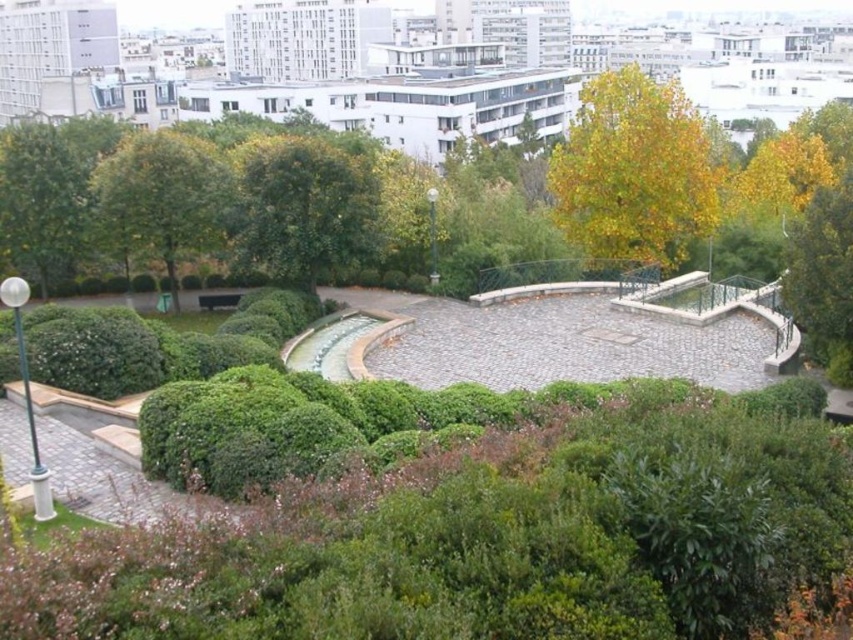
Question: Which object is closer to the camera taking this photo?

Choices:
 (A) yellow-green leaves at upper center
 (B) green leafy tree at center

Answer: (B)

Question: Is yellow-green leaves at upper center in front of green leafy tree at center?

Choices:
 (A) yes
 (B) no

Answer: (B)

Question: Based on their relative distances, which object is farther from the green leafy tree at center?

Choices:
 (A) yellow-green leaves at upper center
 (B) green leafy tree at upper left

Answer: (A)

Question: Does yellow-green leaves at upper center have a smaller size compared to green leafy tree at center?

Choices:
 (A) no
 (B) yes

Answer: (A)

Question: Which point is closer to the camera?

Choices:
 (A) green leafy tree at center
 (B) green leafy tree at upper left

Answer: (A)

Question: Can you confirm if yellow-green leaves at upper center is thinner than green leafy tree at center?

Choices:
 (A) yes
 (B) no

Answer: (B)